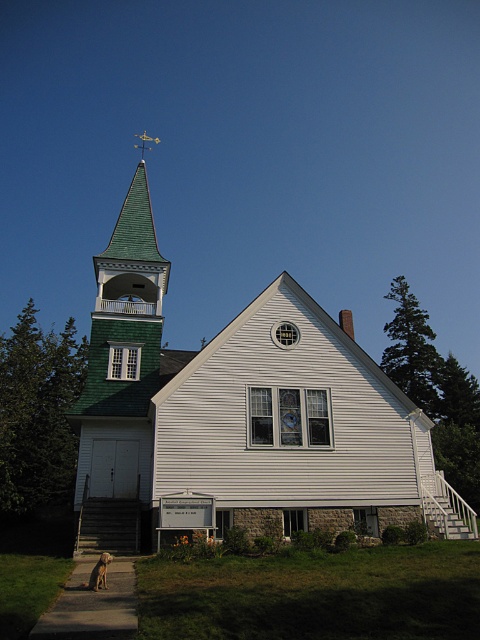
Can you confirm if green shingles at upper left is positioned to the right of brown fur dog at lower left?

In fact, green shingles at upper left is to the left of brown fur dog at lower left.

Is green shingles at upper left positioned at the back of brown fur dog at lower left?

Yes, green shingles at upper left is further from the viewer.

Image resolution: width=480 pixels, height=640 pixels. Identify the location of green shingles at upper left. (120, 381).

The image size is (480, 640). In order to click on green shingles at upper left in this screenshot , I will do `click(120, 381)`.

Can you confirm if white wood church steeple at upper left is positioned to the left of green shingles at upper left?

No, white wood church steeple at upper left is not to the left of green shingles at upper left.

The width and height of the screenshot is (480, 640). Find the location of `white wood church steeple at upper left`. white wood church steeple at upper left is located at coordinates (240, 417).

Who is more forward, (120, 337) or (142, 156)?

Positioned in front is point (120, 337).

Is white wood church steeple at upper left positioned in front of gold/yellow metal cross at upper center?

That is True.

Where is `white wood church steeple at upper left`? The width and height of the screenshot is (480, 640). white wood church steeple at upper left is located at coordinates (240, 417).